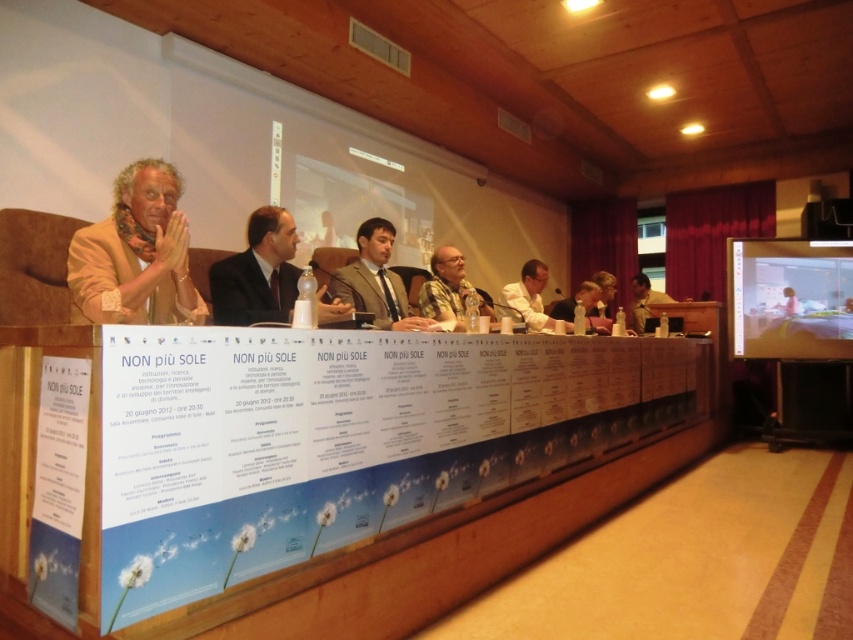
You are a photographer standing behind the long wooden table with the banner. You want to take a photo that includes both the golden textured jacket at left and the patterned yellow shirt at center. What is the minimum distance you need to move backward to ensure both are in frame?

The golden textured jacket at left and the patterned yellow shirt at center are 1.63 meters apart. To include both in the frame, you need to move back at least 1.63 meters to ensure the camera can capture the entire distance between them.

You are attending a formal event and need to decide which item to take with you. You see a dark suit jacket at center and a dark gray suit at center. Which one is shorter?

The dark suit jacket at center is shorter than the dark gray suit at center.